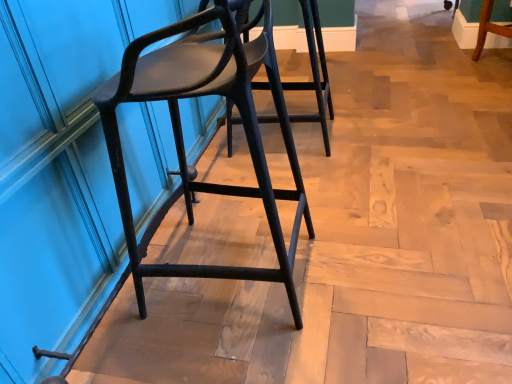
Find the location of a particular element. vacant area that is situated to the right of matte black chair at left is located at coordinates pyautogui.click(x=379, y=257).